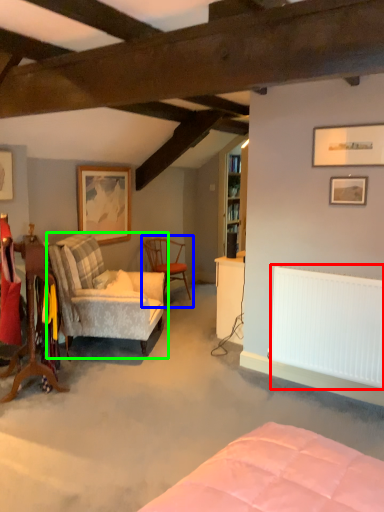
Question: Based on their relative distances, which object is nearer to radiator (highlighted by a red box)? Choose from chair (highlighted by a blue box) and chair (highlighted by a green box).

Choices:
 (A) chair
 (B) chair

Answer: (B)